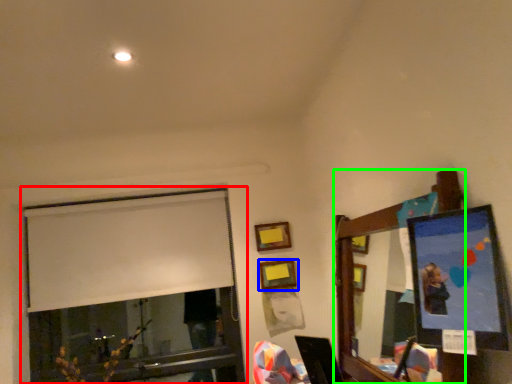
Question: Estimate the real-world distances between objects in this image. Which object is closer to window (highlighted by a red box), picture frame (highlighted by a blue box) or mirror (highlighted by a green box)?

Choices:
 (A) picture frame
 (B) mirror

Answer: (A)